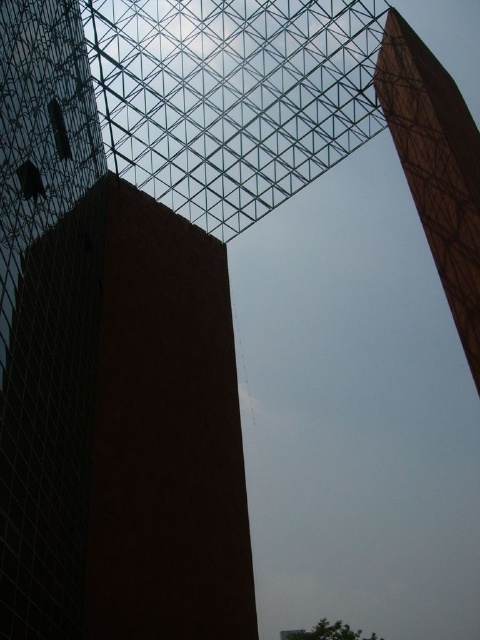
In the scene shown: You are an architect analyzing the structures in the image. Based on the scene, which of the two towers, the brown brick tower at center or the wooden tower at upper right, would require more materials to construct due to its size?

The brown brick tower at center is larger in size than the wooden tower at upper right, so it would require more materials to construct.

You are standing at the base of the brown brick tower at center. If you want to reach the top of the tower, which is 141.45 feet away from you, how many steps would you need to climb if each step is 1 foot high?

The brown brick tower at center is 141.45 feet away from the viewer, so you would need to climb approximately 141 steps to reach the top, assuming each step is 1 foot high.